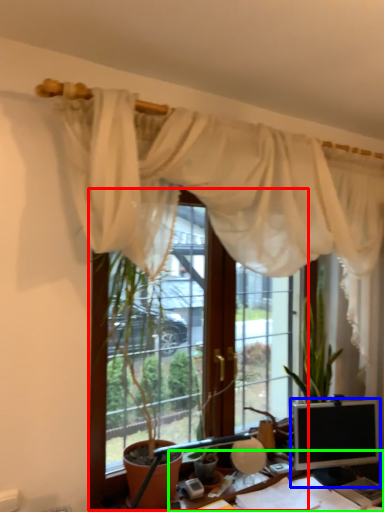
Question: Based on their relative distances, which object is nearer to window (highlighted by a red box)? Choose from computer monitor (highlighted by a blue box) and desk (highlighted by a green box).

Choices:
 (A) computer monitor
 (B) desk

Answer: (B)